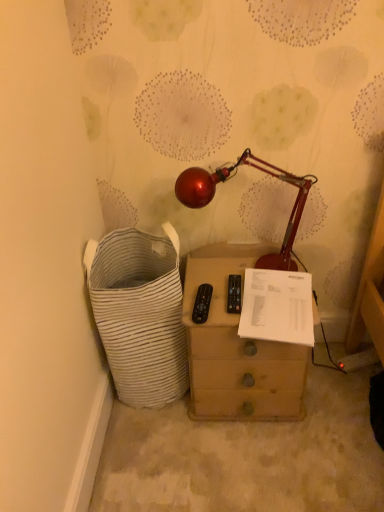
Question: Would you consider white striped fabric laundry basket at left to be distant from shiny metallic lamp at center?

Choices:
 (A) no
 (B) yes

Answer: (A)

Question: Considering the relative sizes of white striped fabric laundry basket at left and shiny metallic lamp at center in the image provided, is white striped fabric laundry basket at left bigger than shiny metallic lamp at center?

Choices:
 (A) no
 (B) yes

Answer: (B)

Question: From a real-world perspective, is white striped fabric laundry basket at left beneath shiny metallic lamp at center?

Choices:
 (A) no
 (B) yes

Answer: (B)

Question: Is white striped fabric laundry basket at left positioned beyond the bounds of shiny metallic lamp at center?

Choices:
 (A) no
 (B) yes

Answer: (B)

Question: Is white striped fabric laundry basket at left wider than shiny metallic lamp at center?

Choices:
 (A) yes
 (B) no

Answer: (A)

Question: From a real-world perspective, is white paper at center positioned above or below white striped fabric laundry basket at left?

Choices:
 (A) above
 (B) below

Answer: (A)

Question: Is white paper at center taller or shorter than white striped fabric laundry basket at left?

Choices:
 (A) short
 (B) tall

Answer: (A)

Question: From the image's perspective, is white paper at center positioned above or below white striped fabric laundry basket at left?

Choices:
 (A) below
 (B) above

Answer: (B)

Question: Is white paper at center wider or thinner than white striped fabric laundry basket at left?

Choices:
 (A) thin
 (B) wide

Answer: (A)

Question: From the image's perspective, is wooden chest of drawers at center located above or below white striped fabric laundry basket at left?

Choices:
 (A) above
 (B) below

Answer: (B)

Question: Does point (256, 371) appear closer or farther from the camera than point (163, 282)?

Choices:
 (A) farther
 (B) closer

Answer: (A)

Question: Is wooden chest of drawers at center situated inside white striped fabric laundry basket at left or outside?

Choices:
 (A) outside
 (B) inside

Answer: (A)

Question: Based on their sizes in the image, would you say wooden chest of drawers at center is bigger or smaller than white striped fabric laundry basket at left?

Choices:
 (A) big
 (B) small

Answer: (B)

Question: Considering the positions of point 274,264 and point 241,391, is point 274,264 closer or farther from the camera than point 241,391?

Choices:
 (A) closer
 (B) farther

Answer: (B)

Question: Looking at their shapes, would you say shiny metallic lamp at center is wider or thinner than wooden chest of drawers at center?

Choices:
 (A) thin
 (B) wide

Answer: (A)